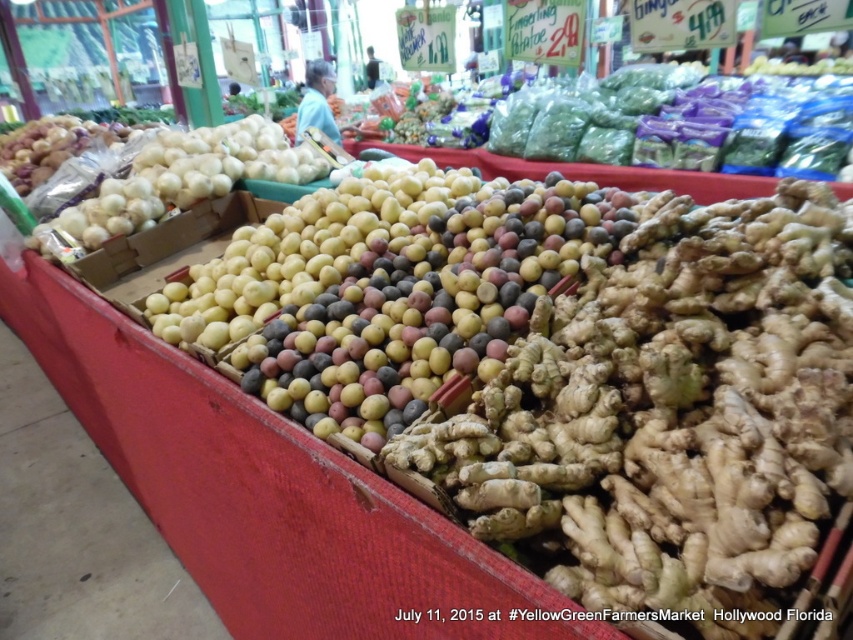
Question: Does multicolored matte potatoes at center appear on the left side of yellow matte potatoes at center?

Choices:
 (A) no
 (B) yes

Answer: (A)

Question: Is multicolored matte potatoes at center further to camera compared to white matte onions at left?

Choices:
 (A) no
 (B) yes

Answer: (A)

Question: Which object is positioned farthest from the yellow matte potatoes at center?

Choices:
 (A) white matte onions at left
 (B) multicolored matte potatoes at center

Answer: (A)

Question: Which point is closer to the camera?

Choices:
 (A) pyautogui.click(x=432, y=204)
 (B) pyautogui.click(x=515, y=216)
 (C) pyautogui.click(x=91, y=230)

Answer: (B)

Question: Which point appears closest to the camera in this image?

Choices:
 (A) (181, 320)
 (B) (251, 147)
 (C) (367, 253)

Answer: (A)

Question: Does yellow matte potatoes at center appear over white matte onions at left?

Choices:
 (A) no
 (B) yes

Answer: (A)